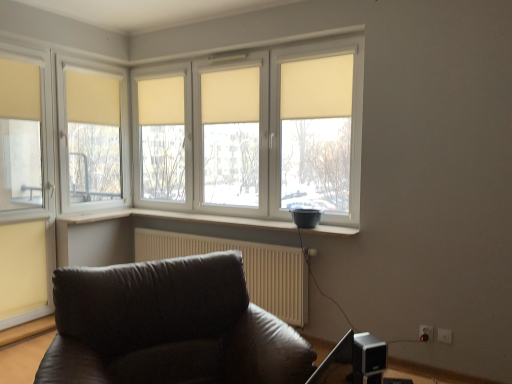
The width and height of the screenshot is (512, 384). In order to click on empty space that is ontop of white matte window at center in this screenshot , I will do `click(232, 56)`.